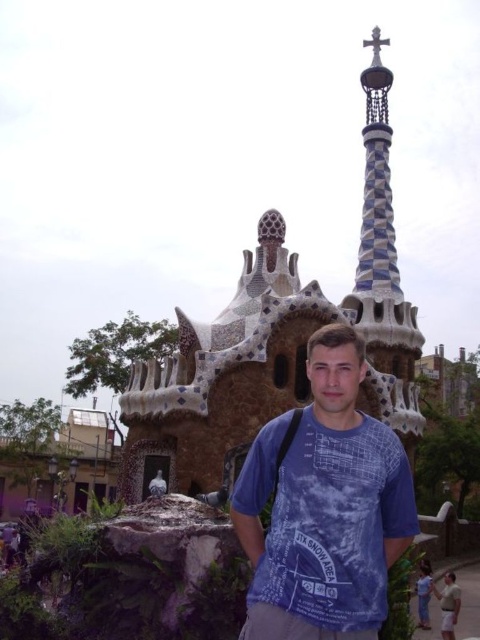
Can you confirm if multicolored mosaic spire at upper right is positioned to the right of smooth beige sand at lower right?

No, multicolored mosaic spire at upper right is not to the right of smooth beige sand at lower right.

What do you see at coordinates (384, 268) in the screenshot?
I see `multicolored mosaic spire at upper right` at bounding box center [384, 268].

Find the location of `multicolored mosaic spire at upper right`. multicolored mosaic spire at upper right is located at coordinates (384, 268).

Who is shorter, blue tie-dye t-shirt at center or smooth beige sand at lower right?

With less height is smooth beige sand at lower right.

Between blue tie-dye t-shirt at center and smooth beige sand at lower right, which one has more height?

blue tie-dye t-shirt at center

In order to click on blue tie-dye t-shirt at center in this screenshot , I will do `click(324, 506)`.

Is point (294, 413) positioned before point (402, 364)?

Yes, it is.

Does blue tie-dye t-shirt at center come behind multicolored mosaic spire at upper right?

That is False.

This screenshot has width=480, height=640. What do you see at coordinates (324, 506) in the screenshot?
I see `blue tie-dye t-shirt at center` at bounding box center [324, 506].

Find the location of a particular element. This screenshot has width=480, height=640. blue tie-dye t-shirt at center is located at coordinates (324, 506).